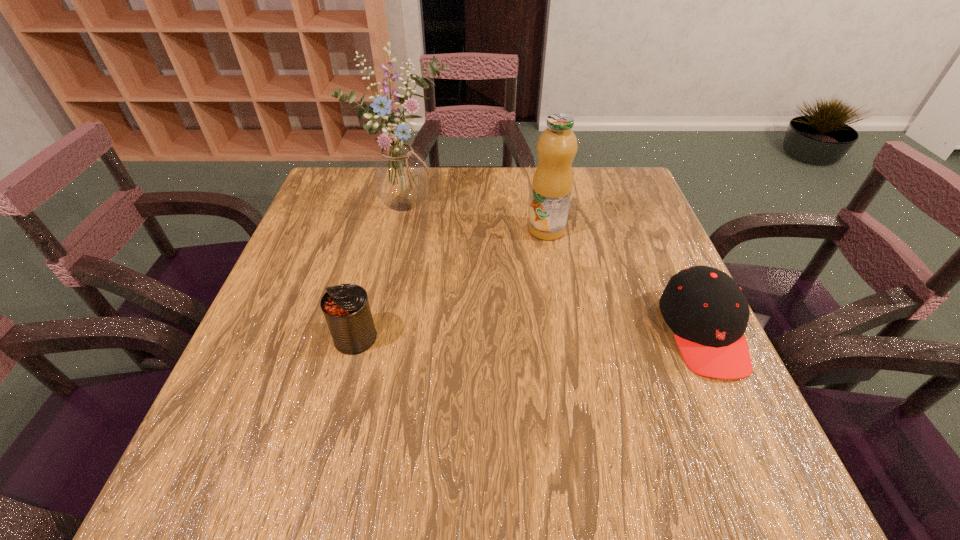
Identify the location of free space located on the front-facing side of the tallest object. (468, 261).

You are a GUI agent. You are given a task and a screenshot of the screen. Output one action in this format:
    pyautogui.click(x=<x>, y=<y>)
    Task: Click on the vacant position located 0.250m on the front label of the fruit juice
    
    Given the screenshot: What is the action you would take?
    pyautogui.click(x=552, y=318)

What are the coordinates of `vacant space located 0.200m on the front label of the fruit juice` in the screenshot? It's located at (551, 301).

Where is `free location located on the front label of the fruit juice`? free location located on the front label of the fruit juice is located at coordinates (548, 255).

At what (x,y) coordinates should I click in order to perform the action: click on object situated at the far edge. Please return your answer as a coordinate pair (x, y). Looking at the image, I should click on (399, 174).

Identify the location of object located at the left edge. The height and width of the screenshot is (540, 960). (399, 174).

Find the location of `object that is at the right edge`. object that is at the right edge is located at coordinates (707, 311).

This screenshot has height=540, width=960. In order to click on object located in the far left corner section of the desktop in this screenshot , I will do `click(399, 174)`.

Identify the location of vacant space at the far edge. (531, 193).

In the image, there is a desktop. Identify the location of vacant space at the near edge. (528, 419).